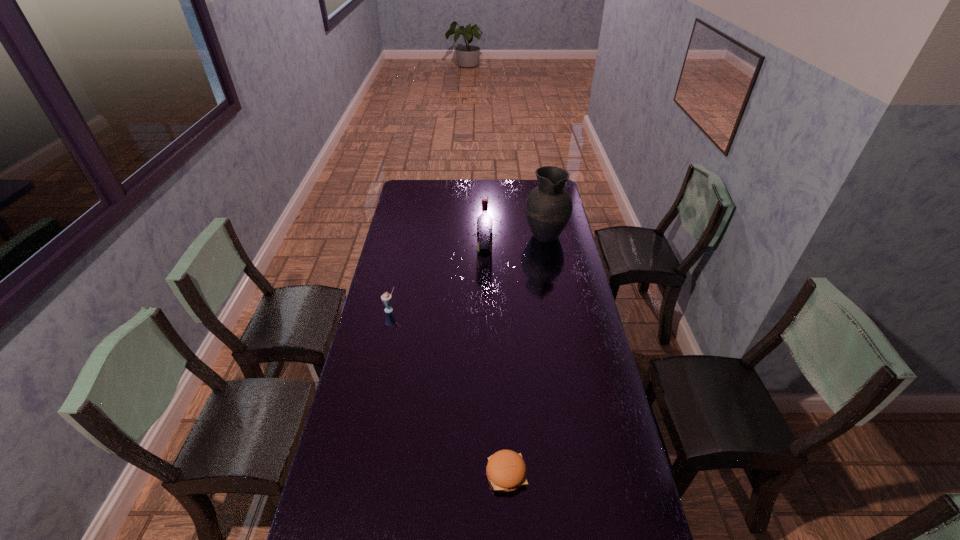
Where is `unoccupied area between the patty and the leftmost object`? unoccupied area between the patty and the leftmost object is located at coordinates (448, 392).

Image resolution: width=960 pixels, height=540 pixels. In order to click on empty space between the pitcher and the alcohol in this screenshot , I will do `click(515, 244)`.

Where is `free space that is in between the leftmost object and the pitcher`? Image resolution: width=960 pixels, height=540 pixels. free space that is in between the leftmost object and the pitcher is located at coordinates (468, 272).

At what (x,y) coordinates should I click in order to perform the action: click on free space between the second shortest object and the pitcher. Please return your answer as a coordinate pair (x, y). Looking at the image, I should click on (468, 272).

Locate an element on the screen. The width and height of the screenshot is (960, 540). free point between the second nearest object and the pitcher is located at coordinates (468, 272).

You are a GUI agent. You are given a task and a screenshot of the screen. Output one action in this format:
    pyautogui.click(x=<x>, y=<y>)
    Task: Click on the vacant area that lies between the third shortest object and the tallest object
    Image resolution: width=960 pixels, height=540 pixels.
    Given the screenshot: What is the action you would take?
    pyautogui.click(x=515, y=244)

Identify the location of blank region between the shortest object and the third farthest object. The image size is (960, 540). (448, 392).

I want to click on object that is the closest to the leftmost object, so click(x=484, y=222).

Point out which object is positioned as the nearest to the rightmost object. Please provide its 2D coordinates. Your answer should be formatted as a tuple, i.e. [(x, y)], where the tuple contains the x and y coordinates of a point satisfying the conditions above.

[(484, 222)]

Image resolution: width=960 pixels, height=540 pixels. Identify the location of free space that satisfies the following two spatial constraints: 1. on the straw side of the nearest object; 2. on the left side of the leftmost object. (355, 474).